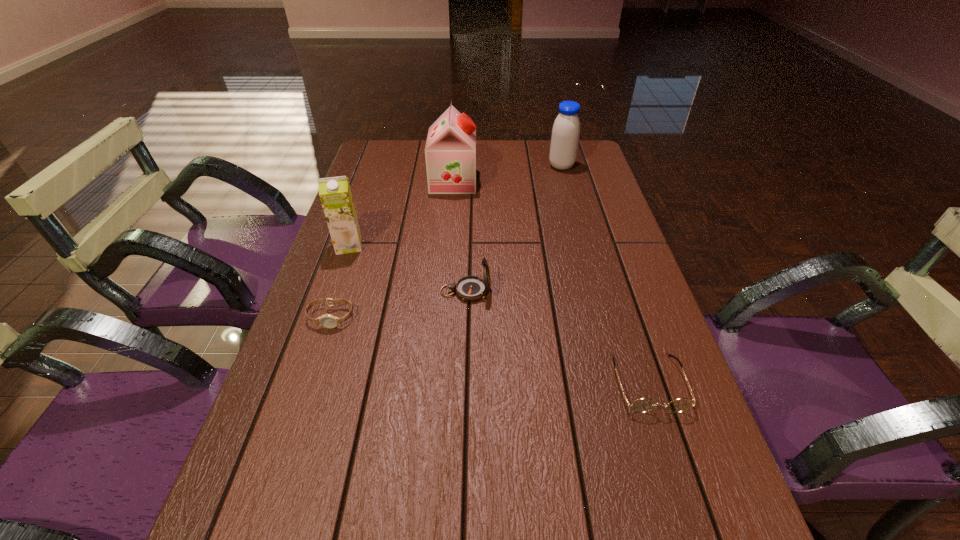
Find the location of a particular element. Image resolution: width=960 pixels, height=540 pixels. vacant area that lies between the second soya milk from left to right and the compass is located at coordinates (460, 237).

At what (x,y) coordinates should I click in order to perform the action: click on object identified as the third closest to the watch. Please return your answer as a coordinate pair (x, y). The width and height of the screenshot is (960, 540). Looking at the image, I should click on (450, 152).

What are the coordinates of `object that stands as the third closest to the rightmost soya milk` in the screenshot? It's located at (335, 194).

Locate which soya milk ranks in proximity to the second soya milk from right to left. Please provide its 2D coordinates. Your answer should be formatted as a tuple, i.e. [(x, y)], where the tuple contains the x and y coordinates of a point satisfying the conditions above.

[(566, 129)]

The image size is (960, 540). In order to click on the second closest soya milk to the watch in this screenshot , I will do `click(450, 152)`.